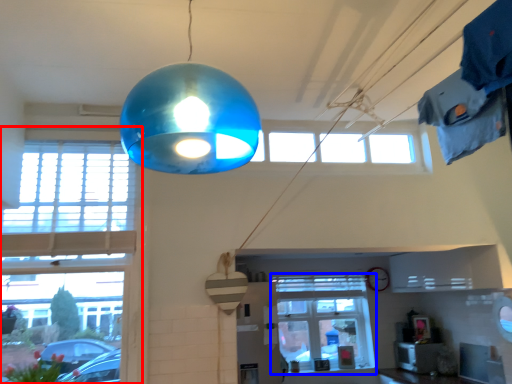
Question: Among these objects, which one is nearest to the camera, window (highlighted by a red box) or window (highlighted by a blue box)?

Choices:
 (A) window
 (B) window

Answer: (A)